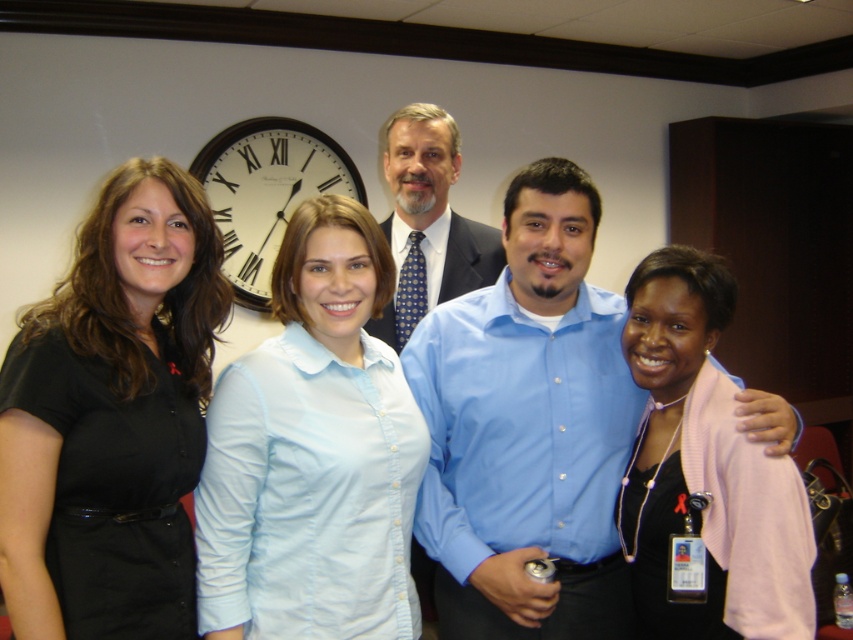
Question: Is the position of blue shirt at center less distant than that of white glossy clock at upper center?

Choices:
 (A) yes
 (B) no

Answer: (A)

Question: Which of the following is the farthest from the observer?

Choices:
 (A) (234, 275)
 (B) (405, 216)
 (C) (517, 362)

Answer: (A)

Question: Can you confirm if blue shirt at center is positioned below white glossy clock at upper center?

Choices:
 (A) yes
 (B) no

Answer: (A)

Question: Is pink fabric shirt at center thinner than blue shirt at center?

Choices:
 (A) yes
 (B) no

Answer: (A)

Question: Based on their relative distances, which object is nearer to the light blue button-down shirt at center?

Choices:
 (A) white glossy clock at upper center
 (B) pink fabric shirt at center
 (C) black shirt at left
 (D) blue button-down shirt at center

Answer: (C)

Question: Which point appears closest to the camera in this image?

Choices:
 (A) (390, 218)
 (B) (415, 611)
 (C) (554, 348)

Answer: (B)